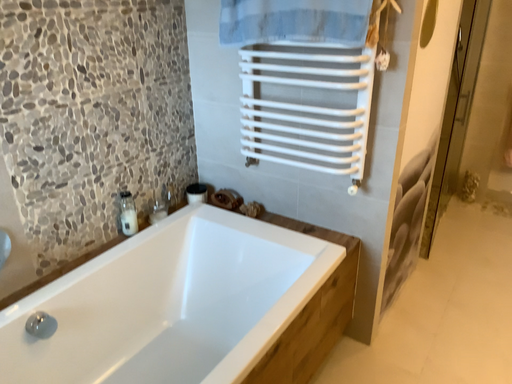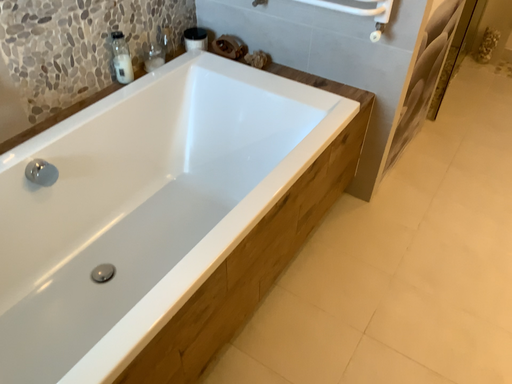
Question: How did the camera likely rotate when shooting the video?

Choices:
 (A) rotated upward
 (B) rotated downward

Answer: (B)